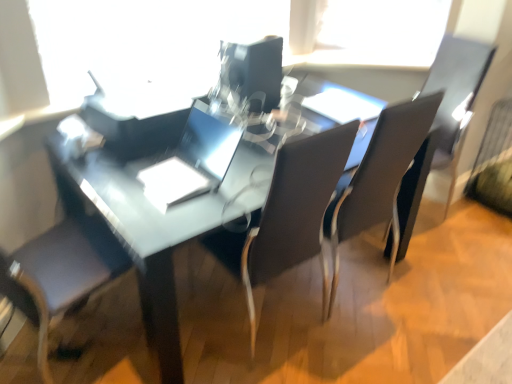
Where is `blank area beneath sleek silver laptop at center (from a real-world perspective)`? This screenshot has width=512, height=384. blank area beneath sleek silver laptop at center (from a real-world perspective) is located at coordinates (169, 173).